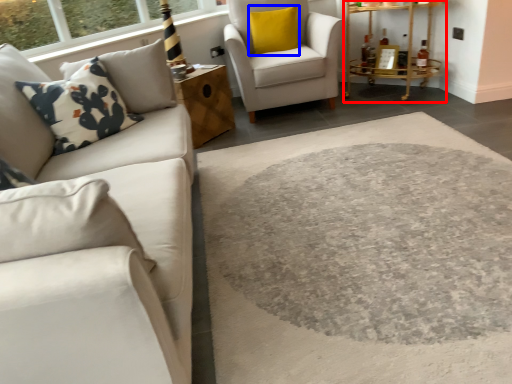
Question: Among these objects, which one is farthest to the camera, table (highlighted by a red box) or pillow (highlighted by a blue box)?

Choices:
 (A) table
 (B) pillow

Answer: (B)